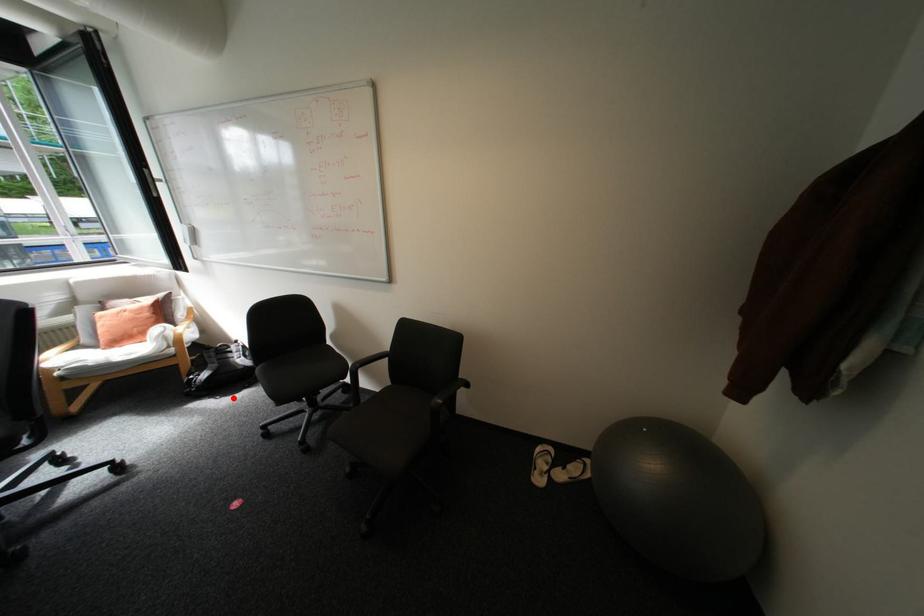
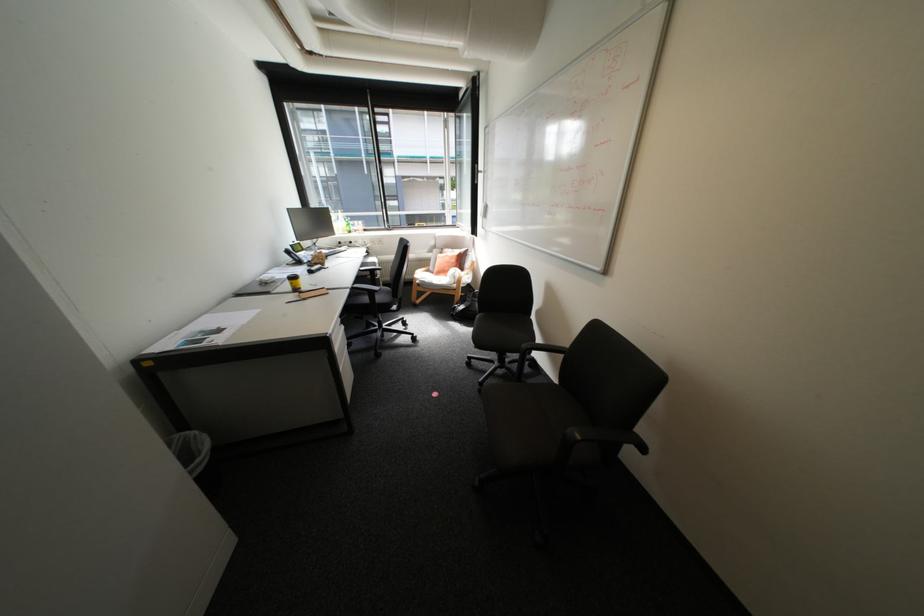
Where in the second image is the point corresponding to the highlighted location from the first image?

(473, 326)